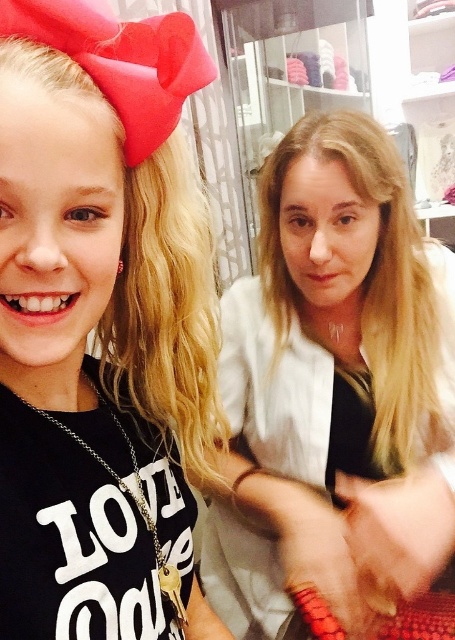
You are a store employee organizing a rack of clothing. You have to place the matte black shirt at left and the smooth white blouse at center onto the same hanger. Which one should you place on the left side of the hanger to ensure they both fit without overlapping?

The matte black shirt at left should be placed on the left side of the hanger because it has a lesser width compared to the smooth white blouse at center, allowing both items to fit without overlapping.

You are a store employee who needs to hang a price tag on the taller item between the matte black shirt at left and the smooth white blouse at center. Which item should you choose?

The smooth white blouse at center is taller than the matte black shirt at left, so you should hang the price tag on the smooth white blouse at center.